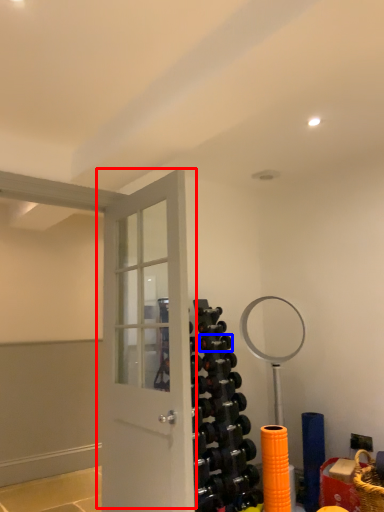
Question: Which point is closer to the camera, door (highlighted by a red box) or dumbbell (highlighted by a blue box)?

Choices:
 (A) door
 (B) dumbbell

Answer: (A)